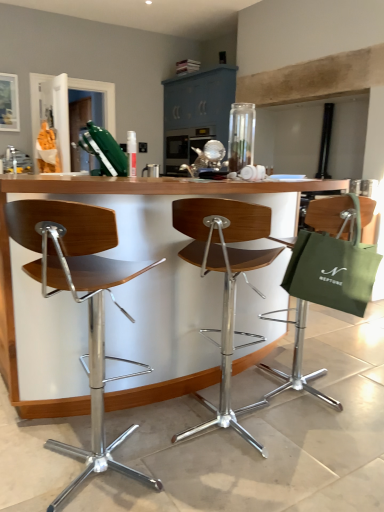
Question: Can you confirm if wooden seat at center, which is counted as the 2th chair, starting from the right, is taller than woodenmaterial/texturetable at center?

Choices:
 (A) yes
 (B) no

Answer: (B)

Question: From the image's perspective, is wooden seat at center, which is counted as the second chair, starting from the left, located above woodenmaterial/texturetable at center?

Choices:
 (A) yes
 (B) no

Answer: (B)

Question: Considering the relative sizes of wooden seat at center, which is counted as the 2th chair, starting from the right, and woodenmaterial/texturetable at center in the image provided, is wooden seat at center, which is counted as the 2th chair, starting from the right, thinner than woodenmaterial/texturetable at center?

Choices:
 (A) no
 (B) yes

Answer: (B)

Question: Is wooden seat at center, which is counted as the 2th chair, starting from the right, wider than woodenmaterial/texturetable at center?

Choices:
 (A) yes
 (B) no

Answer: (B)

Question: Is wooden seat at center, which is counted as the 2th chair, starting from the right, with woodenmaterial/texturetable at center?

Choices:
 (A) yes
 (B) no

Answer: (B)

Question: Is woodenmaterial/texturetable at center inside wooden seat at center, which is counted as the second chair, starting from the left?

Choices:
 (A) yes
 (B) no

Answer: (B)

Question: Is woodenmaterial/texturetable at center oriented away from green canvas tote at right?

Choices:
 (A) no
 (B) yes

Answer: (B)

Question: Can you confirm if woodenmaterial/texturetable at center is positioned to the right of green canvas tote at right?

Choices:
 (A) yes
 (B) no

Answer: (B)

Question: Does woodenmaterial/texturetable at center have a greater width compared to green canvas tote at right?

Choices:
 (A) no
 (B) yes

Answer: (B)

Question: Is woodenmaterial/texturetable at center to the left of green canvas tote at right from the viewer's perspective?

Choices:
 (A) yes
 (B) no

Answer: (A)

Question: Does woodenmaterial/texturetable at center have a larger size compared to green canvas tote at right?

Choices:
 (A) yes
 (B) no

Answer: (A)

Question: Considering the relative sizes of woodenmaterial/texturetable at center and green canvas tote at right in the image provided, is woodenmaterial/texturetable at center shorter than green canvas tote at right?

Choices:
 (A) no
 (B) yes

Answer: (A)

Question: Is wooden seat at center, which is counted as the 2th chair, starting from the right, at the left side of green canvas tote at right?

Choices:
 (A) no
 (B) yes

Answer: (B)